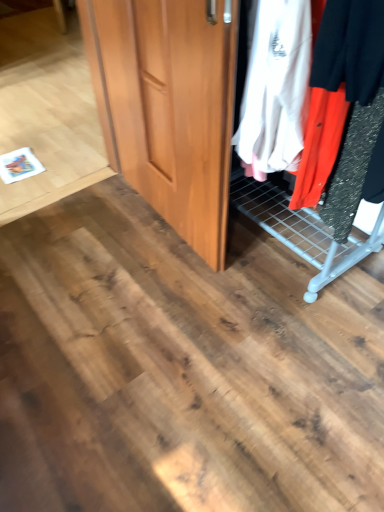
Locate an element on the screen. vacant area located to the right-hand side of wooden door at center is located at coordinates (273, 239).